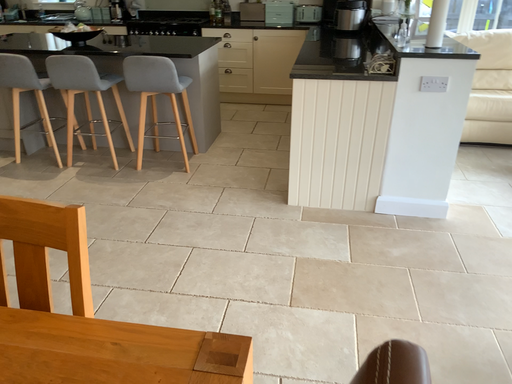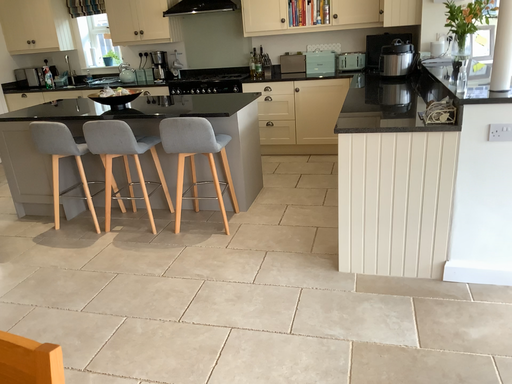
Question: Which way did the camera rotate in the video?

Choices:
 (A) rotated left
 (B) rotated right

Answer: (A)